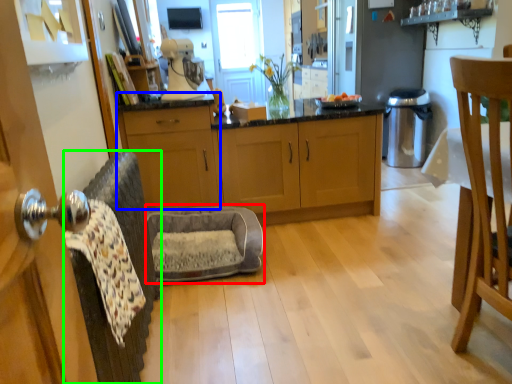
Question: Which object is the farthest from swivel chair (highlighted by a red box)? Choose among these: cabinetry (highlighted by a blue box) or swivel chair (highlighted by a green box).

Choices:
 (A) cabinetry
 (B) swivel chair

Answer: (B)